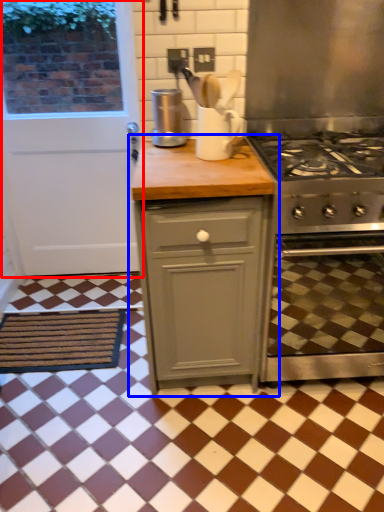
Question: Among these objects, which one is nearest to the camera, door (highlighted by a red box) or cabinetry (highlighted by a blue box)?

Choices:
 (A) door
 (B) cabinetry

Answer: (B)